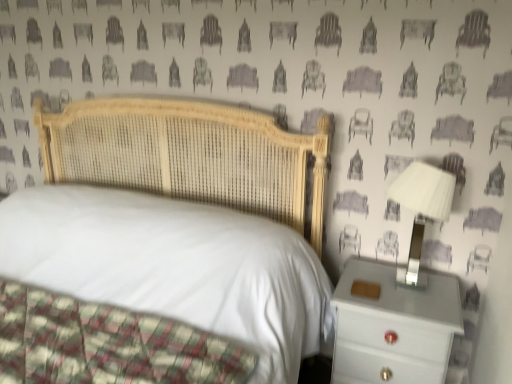
Question: Is there a large distance between woven wood bed at center and white plastic lampshade at right?

Choices:
 (A) yes
 (B) no

Answer: (B)

Question: From a real-world perspective, is woven wood bed at center located beneath white plastic lampshade at right?

Choices:
 (A) no
 (B) yes

Answer: (B)

Question: Could you tell me if woven wood bed at center is facing white plastic lampshade at right?

Choices:
 (A) no
 (B) yes

Answer: (A)

Question: Is woven wood bed at center facing away from white plastic lampshade at right?

Choices:
 (A) yes
 (B) no

Answer: (B)

Question: Does woven wood bed at center have a larger size compared to white plastic lampshade at right?

Choices:
 (A) yes
 (B) no

Answer: (A)

Question: In terms of height, does woven wood bed at center look taller or shorter compared to white glossy nightstand at right?

Choices:
 (A) short
 (B) tall

Answer: (B)

Question: Is woven wood bed at center inside the boundaries of white glossy nightstand at right, or outside?

Choices:
 (A) outside
 (B) inside

Answer: (A)

Question: Relative to white glossy nightstand at right, is woven wood bed at center in front or behind?

Choices:
 (A) front
 (B) behind

Answer: (A)

Question: From a real-world perspective, relative to white glossy nightstand at right, is woven wood bed at center vertically above or below?

Choices:
 (A) below
 (B) above

Answer: (B)

Question: Considering their positions, is white plastic lampshade at right located in front of or behind woven wood bed at center?

Choices:
 (A) behind
 (B) front

Answer: (A)

Question: From a real-world perspective, is white plastic lampshade at right positioned above or below woven wood bed at center?

Choices:
 (A) below
 (B) above

Answer: (B)

Question: Considering the positions of white plastic lampshade at right and woven wood bed at center in the image, is white plastic lampshade at right taller or shorter than woven wood bed at center?

Choices:
 (A) tall
 (B) short

Answer: (B)

Question: Is point (402, 200) closer or farther from the camera than point (241, 195)?

Choices:
 (A) closer
 (B) farther

Answer: (A)

Question: Considering the positions of woven wood bed at center and white plastic lampshade at right in the image, is woven wood bed at center bigger or smaller than white plastic lampshade at right?

Choices:
 (A) big
 (B) small

Answer: (A)

Question: Is woven wood bed at center inside the boundaries of white plastic lampshade at right, or outside?

Choices:
 (A) inside
 (B) outside

Answer: (B)